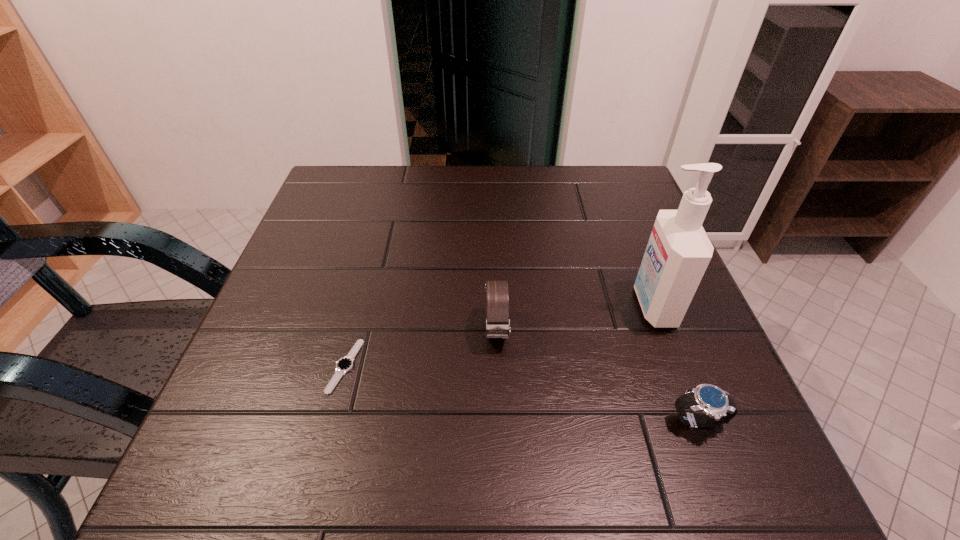
The width and height of the screenshot is (960, 540). What are the coordinates of `vacant space at the right edge of the desktop` in the screenshot? It's located at (669, 375).

Locate an element on the screen. This screenshot has width=960, height=540. free space at the far left corner is located at coordinates (314, 199).

Identify the location of free region at the near left corner of the desktop. (204, 454).

Image resolution: width=960 pixels, height=540 pixels. In the image, there is a desktop. What are the coordinates of `blank space at the far right corner` in the screenshot? It's located at (586, 206).

The width and height of the screenshot is (960, 540). What are the coordinates of `free space between the tallest object and the second shortest object` in the screenshot? It's located at (676, 364).

Find the location of a particular element. The width and height of the screenshot is (960, 540). empty space between the second shortest watch and the tallest object is located at coordinates (676, 364).

Where is `empty space between the second tallest watch and the shortest object`? The width and height of the screenshot is (960, 540). empty space between the second tallest watch and the shortest object is located at coordinates (521, 394).

Where is `empty space between the shortest watch and the third shortest object`? empty space between the shortest watch and the third shortest object is located at coordinates (420, 348).

Locate an element on the screen. This screenshot has width=960, height=540. object that is the third closest to the third tallest object is located at coordinates (345, 364).

The width and height of the screenshot is (960, 540). Find the location of `the third closest object to the leftmost object`. the third closest object to the leftmost object is located at coordinates (678, 252).